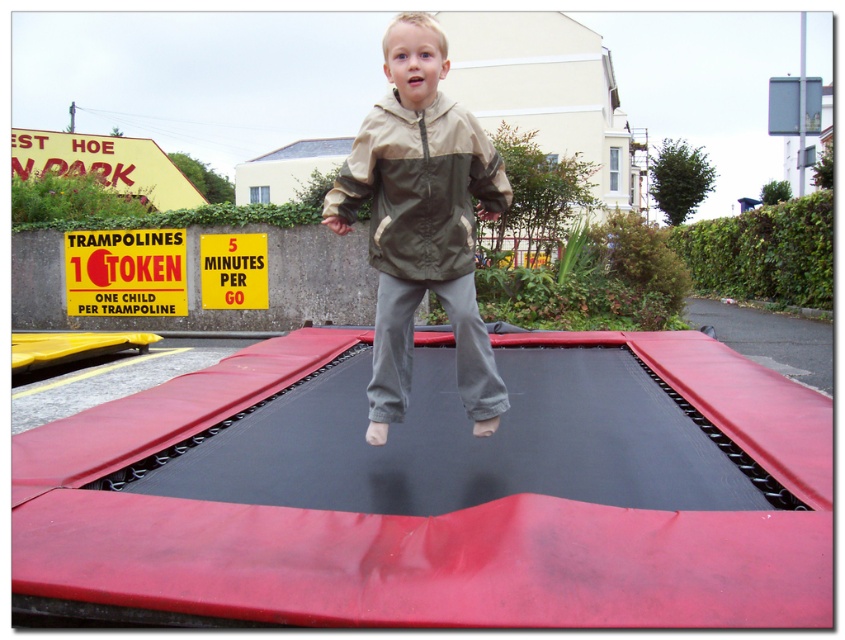
You are holding a camera and want to take a photo of the khaki fabric jacket at center. If the camera has a maximum focus range of 2 meters, will you be able to capture the jacket clearly?

The khaki fabric jacket at center and camera are 2.21 meters apart from each other, which exceeds the camera maximum focus range of 2 meters. Therefore, the camera cannot capture the jacket clearly.